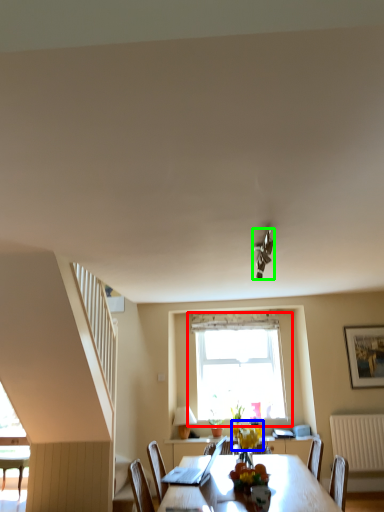
Question: Estimate the real-world distances between objects in this image. Which object is farther from window (highlighted by a red box), flower (highlighted by a blue box) or light fixture (highlighted by a green box)?

Choices:
 (A) flower
 (B) light fixture

Answer: (B)